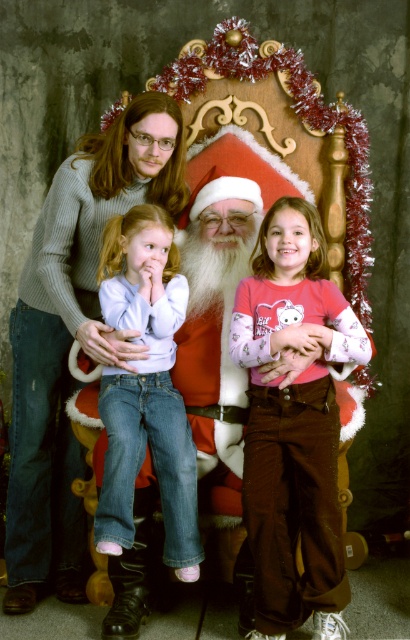
Which is more to the right, pink cotton shirt at center or denim jeans at center?

pink cotton shirt at center

Is pink cotton shirt at center positioned behind denim jeans at center?

That is True.

Is point (296, 604) closer to camera compared to point (191, 502)?

Yes, point (296, 604) is closer to viewer.

Where is `pink cotton shirt at center`? The width and height of the screenshot is (410, 640). pink cotton shirt at center is located at coordinates (293, 422).